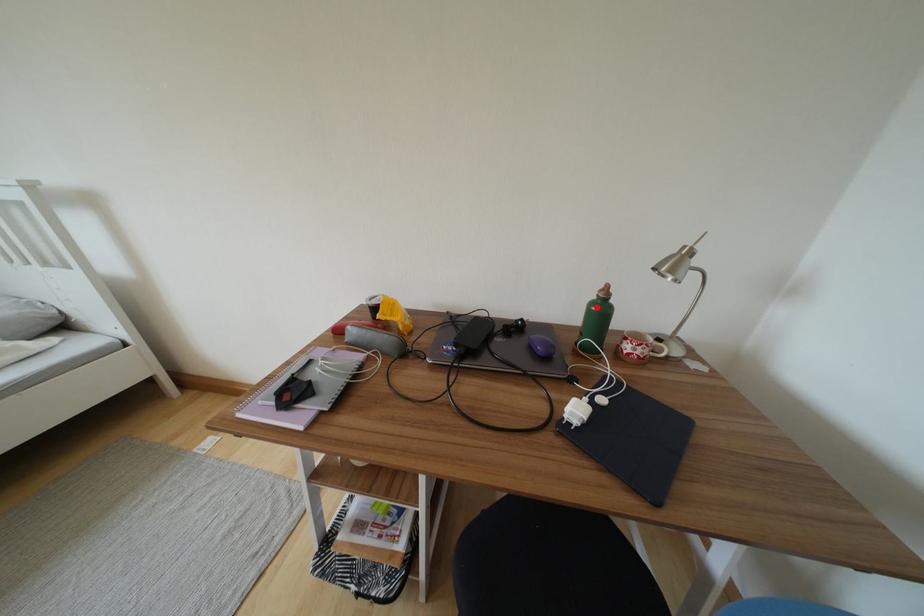
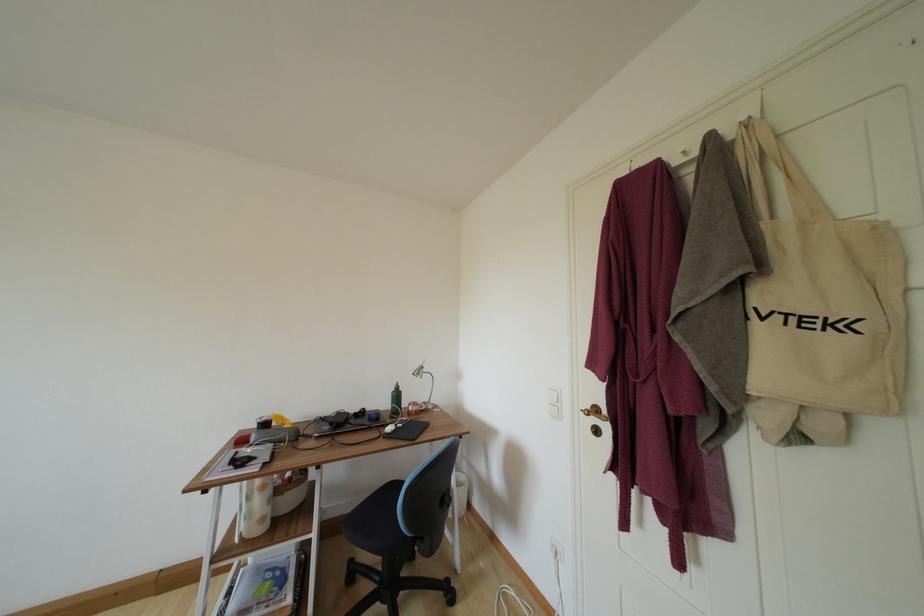
Question: I am providing you with two images of the same scene from different viewpoints. A red point is shown in image1. For the corresponding object point in image2, is it positioned nearer or farther from the camera?

Choices:
 (A) Nearer
 (B) Farther

Answer: (B)